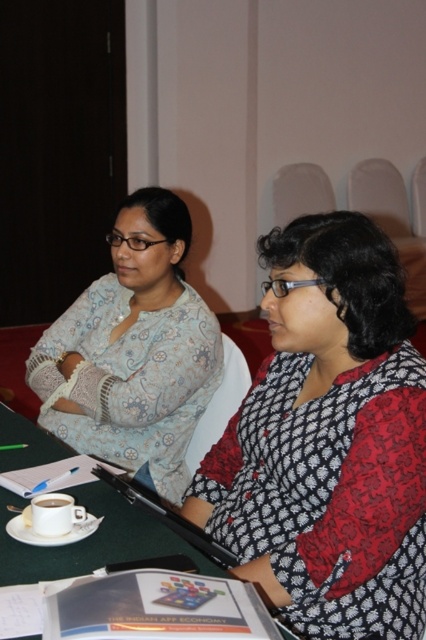
You are a server in a cafe and need to deliver two cups to the table. The matte white cup at lower left contains hot tea, and the white ceramic cup at center has a coffee with a saucer. Based on their positions, which cup should you pick up first to avoid spilling the tea?

You should pick up the matte white cup at lower left first because it is positioned under the white ceramic cup at center, so lifting the upper cup first might cause the lower one to tip over.

You are a guest at this meeting and want to place your bag on the table without disturbing the items. The table has limited space. Which object should you move to make space, the patterned fabric sweater at center or the white ceramic cup at center?

You should move the patterned fabric sweater at center to the right of the white ceramic cup at center to create space for your bag.